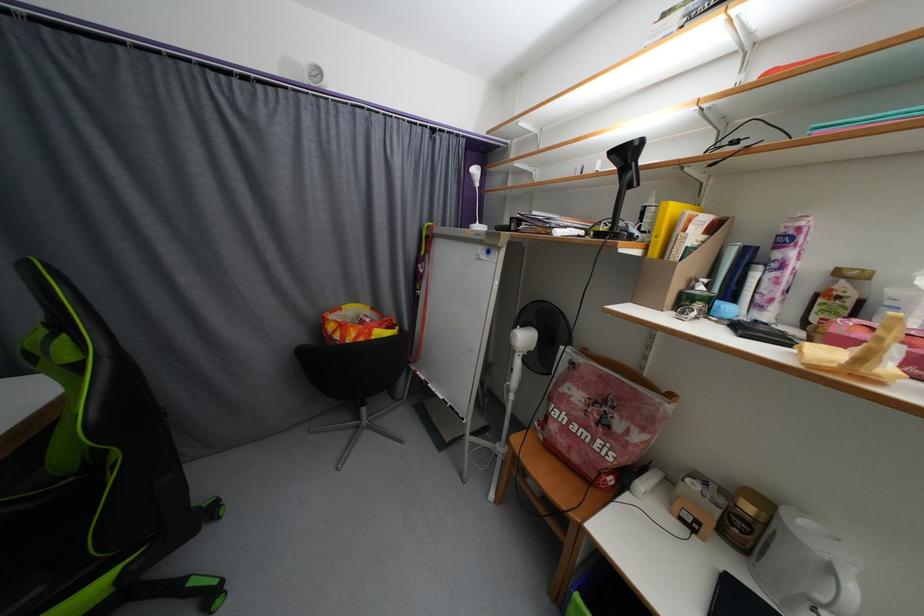
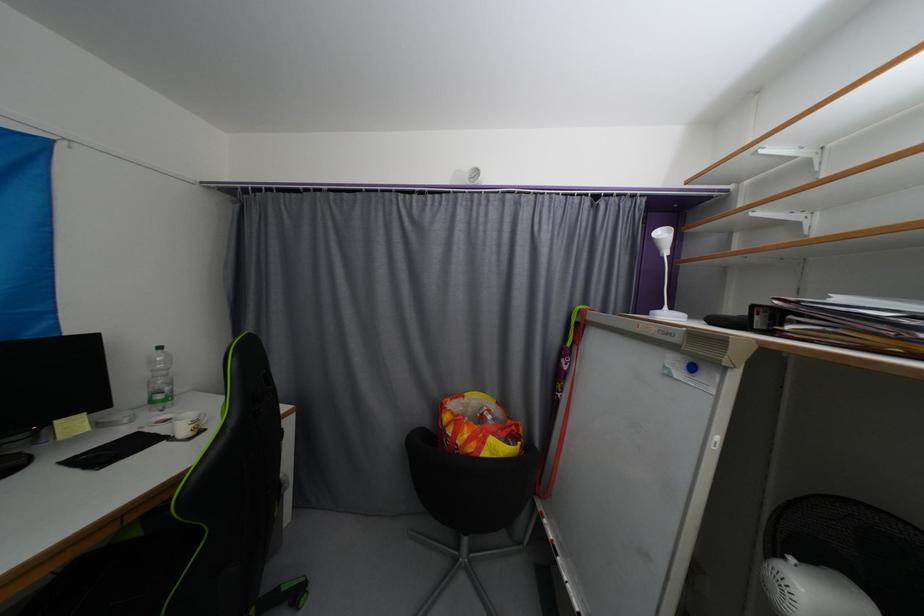
Where in the second image is the point corresponding to the point at 335,329 from the first image?

(452, 419)